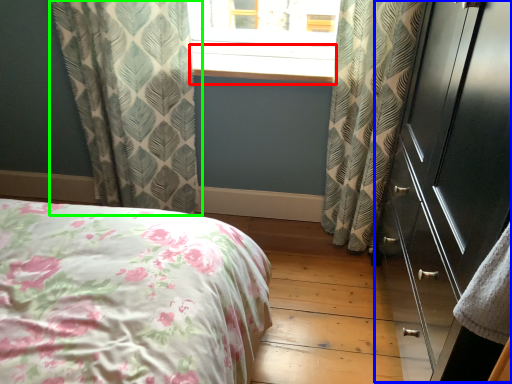
Question: Estimate the real-world distances between objects in this image. Which object is closer to window sill (highlighted by a red box), dresser (highlighted by a blue box) or curtain (highlighted by a green box)?

Choices:
 (A) dresser
 (B) curtain

Answer: (B)